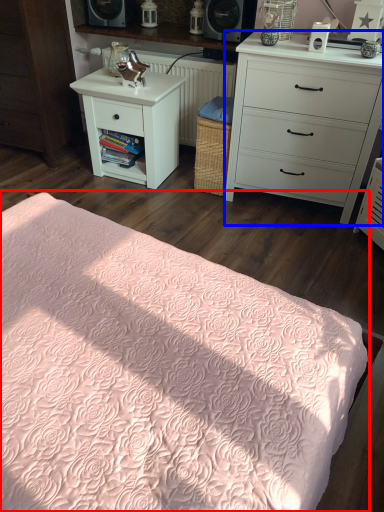
Question: Which point is closer to the camera, bed (highlighted by a red box) or chest of drawers (highlighted by a blue box)?

Choices:
 (A) bed
 (B) chest of drawers

Answer: (A)